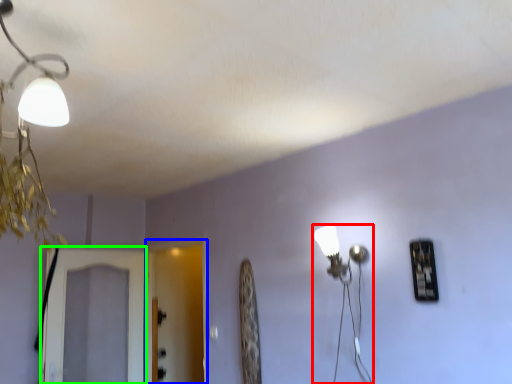
Question: Which is farther away from lamp (highlighted by a red box)? screen door (highlighted by a blue box) or screen door (highlighted by a green box)?

Choices:
 (A) screen door
 (B) screen door

Answer: (A)